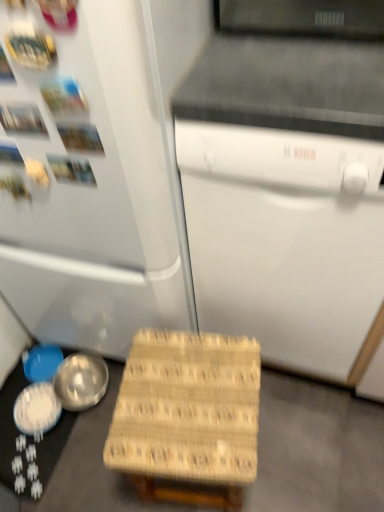
Identify the location of vacant space situated on the left part of blue matte bowl at lower left, acting as the 1th bowl starting from the left. (19, 377).